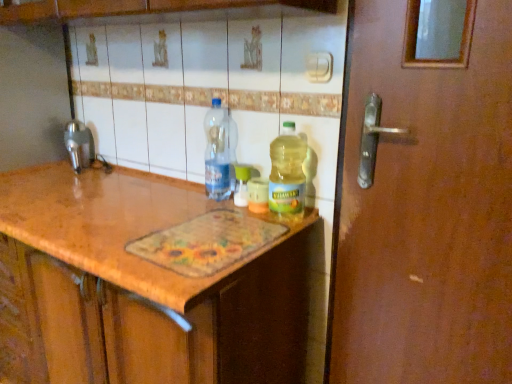
Question: Is brushed metal faucet at left next to translucent plastic bottle at center, which ranks as the second bottle in left-to-right order?

Choices:
 (A) no
 (B) yes

Answer: (A)

Question: Is brushed metal faucet at left bigger than translucent plastic bottle at center, positioned as the 2th bottle in right-to-left order?

Choices:
 (A) yes
 (B) no

Answer: (A)

Question: From a real-world perspective, is brushed metal faucet at left under translucent plastic bottle at center, which ranks as the second bottle in left-to-right order?

Choices:
 (A) yes
 (B) no

Answer: (B)

Question: Does brushed metal faucet at left turn towards translucent plastic bottle at center, positioned as the 2th bottle in right-to-left order?

Choices:
 (A) no
 (B) yes

Answer: (A)

Question: Is brushed metal faucet at left taller than translucent plastic bottle at center, which ranks as the second bottle in left-to-right order?

Choices:
 (A) yes
 (B) no

Answer: (A)

Question: Would you say transparent plastic bottle at center, the 1th bottle when ordered from left to right, is to the left or to the right of translucent plastic bottle at center, which ranks as the second bottle in left-to-right order, in the picture?

Choices:
 (A) left
 (B) right

Answer: (A)

Question: In terms of height, does transparent plastic bottle at center, which appears as the 3th bottle when viewed from the right, look taller or shorter compared to translucent plastic bottle at center, positioned as the 2th bottle in right-to-left order?

Choices:
 (A) tall
 (B) short

Answer: (A)

Question: From the image's perspective, is transparent plastic bottle at center, the 1th bottle when ordered from left to right, positioned above or below translucent plastic bottle at center, positioned as the 2th bottle in right-to-left order?

Choices:
 (A) below
 (B) above

Answer: (B)

Question: Looking at their shapes, would you say transparent plastic bottle at center, the 1th bottle when ordered from left to right, is wider or thinner than translucent plastic bottle at center, which ranks as the second bottle in left-to-right order?

Choices:
 (A) thin
 (B) wide

Answer: (B)

Question: From their relative heights in the image, would you say translucent plastic bottle at center, which ranks as the second bottle in left-to-right order, is taller or shorter than brushed metal faucet at left?

Choices:
 (A) short
 (B) tall

Answer: (A)

Question: Is point [234, 192] closer or farther from the camera than point [93, 157]?

Choices:
 (A) closer
 (B) farther

Answer: (A)

Question: From the image's perspective, is translucent plastic bottle at center, positioned as the 2th bottle in right-to-left order, above or below brushed metal faucet at left?

Choices:
 (A) above
 (B) below

Answer: (B)

Question: Based on their sizes in the image, would you say translucent plastic bottle at center, which ranks as the second bottle in left-to-right order, is bigger or smaller than brushed metal faucet at left?

Choices:
 (A) big
 (B) small

Answer: (B)

Question: Considering their positions, is brushed metal faucet at left located in front of or behind translucent plastic bottle at center, the first bottle viewed from the right?

Choices:
 (A) front
 (B) behind

Answer: (B)

Question: In terms of height, does brushed metal faucet at left look taller or shorter compared to translucent plastic bottle at center, which is the third bottle from left to right?

Choices:
 (A) short
 (B) tall

Answer: (A)